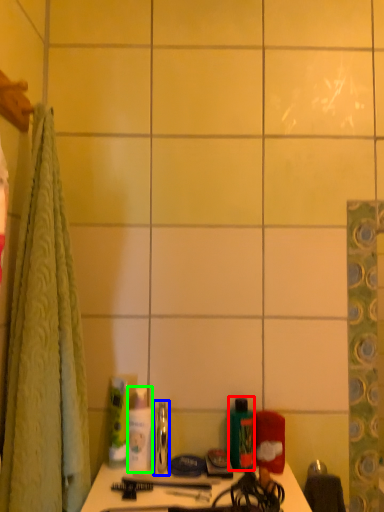
Question: Which object is the closest to the mouthwash (highlighted by a red box)? Choose among these: mouthwash (highlighted by a blue box) or toiletry (highlighted by a green box).

Choices:
 (A) mouthwash
 (B) toiletry

Answer: (A)